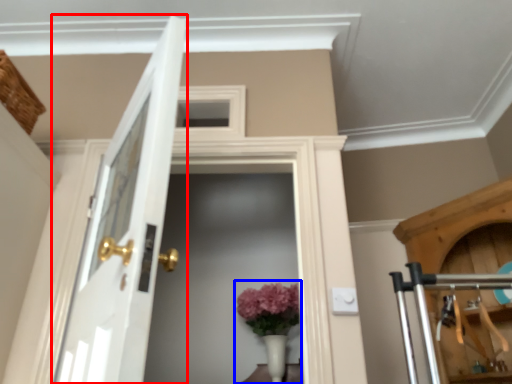
Question: Which object appears farthest to the camera in this image, door (highlighted by a red box) or floral arrangement (highlighted by a blue box)?

Choices:
 (A) door
 (B) floral arrangement

Answer: (B)